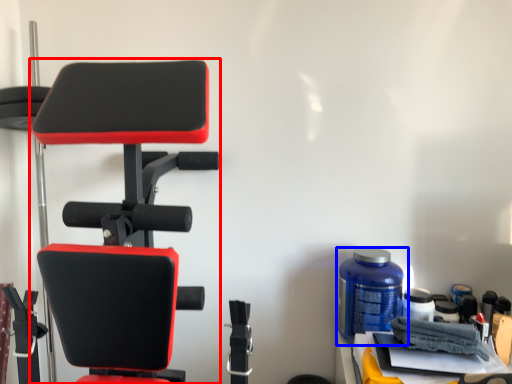
Question: Which object appears closest to the camera in this image, chair (highlighted by a red box) or bottle (highlighted by a blue box)?

Choices:
 (A) chair
 (B) bottle

Answer: (A)